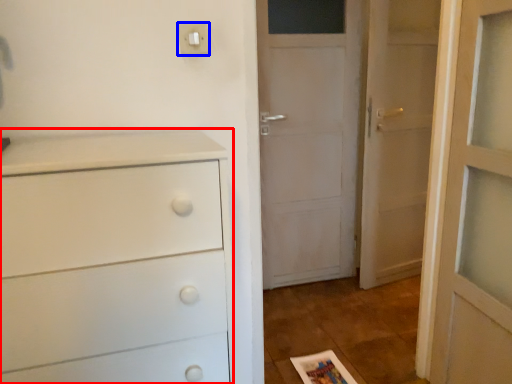
Question: Which object appears farthest to the camera in this image, chest of drawers (highlighted by a red box) or light switch (highlighted by a blue box)?

Choices:
 (A) chest of drawers
 (B) light switch

Answer: (B)